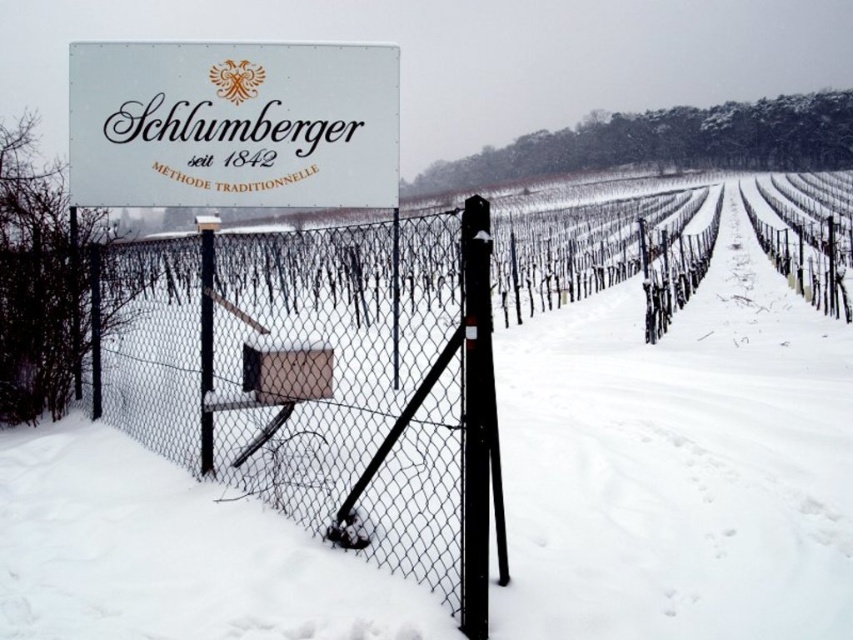
Question: Which of the following is the closest to the observer?

Choices:
 (A) (263, 604)
 (B) (254, 84)

Answer: (A)

Question: Is white powdery snow at center positioned behind white matte sign at upper center?

Choices:
 (A) no
 (B) yes

Answer: (A)

Question: Is white powdery snow at center thinner than white matte sign at upper center?

Choices:
 (A) no
 (B) yes

Answer: (A)

Question: Can you confirm if white powdery snow at center is bigger than white matte sign at upper center?

Choices:
 (A) no
 (B) yes

Answer: (B)

Question: Which point is closer to the camera taking this photo?

Choices:
 (A) (120, 115)
 (B) (709, 292)

Answer: (A)